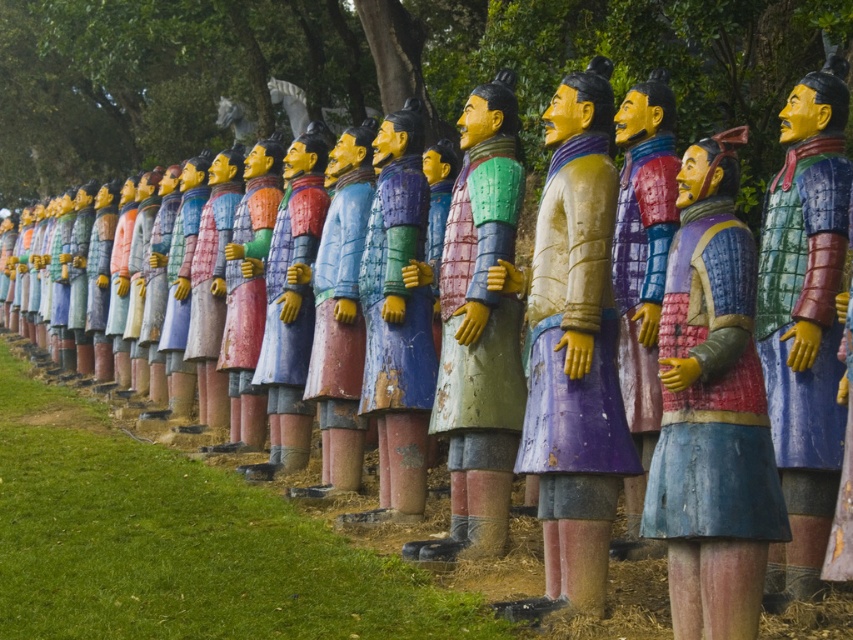
Question: Which object is the farthest from the matte wooden statue at center?

Choices:
 (A) matte painted statue at center
 (B) wooden armor figure at center

Answer: (B)

Question: Which of the following is the farthest from the observer?

Choices:
 (A) matte blue armor at center
 (B) matte wooden statue at center
 (C) matte painted figure at center
 (D) matte green armor at center

Answer: (B)

Question: Is matte green armor at center above matte wooden statue at center?

Choices:
 (A) no
 (B) yes

Answer: (A)

Question: Can you confirm if matte painted statue at center is wider than matte green armor at center?

Choices:
 (A) no
 (B) yes

Answer: (B)

Question: Is the position of wooden figure at center more distant than that of matte purple wood statue at center?

Choices:
 (A) yes
 (B) no

Answer: (B)

Question: Which of the following is the farthest from the observer?

Choices:
 (A) matte painted statue at center
 (B) wooden armor figure at center
 (C) matte wooden statue at center

Answer: (C)